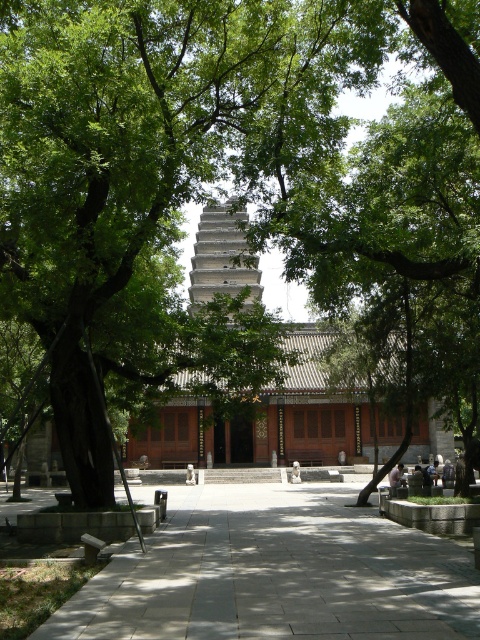
Does gray stone pavement at center have a lesser height compared to gray stone tower at center?

Yes, gray stone pavement at center is shorter than gray stone tower at center.

Which is behind, point (374, 540) or point (226, 209)?

The point (226, 209) is more distant.

Is point (333, 545) positioned before point (202, 300)?

Yes, point (333, 545) is closer to viewer.

Where is `gray stone pavement at center`? Image resolution: width=480 pixels, height=640 pixels. gray stone pavement at center is located at coordinates (x=276, y=573).

Does gray stone tower at center appear under light brown wooden bench at center?

Actually, gray stone tower at center is above light brown wooden bench at center.

Is gray stone tower at center to the left of light brown wooden bench at center from the viewer's perspective?

Yes, gray stone tower at center is to the left of light brown wooden bench at center.

Locate an element on the screen. The width and height of the screenshot is (480, 640). gray stone tower at center is located at coordinates (223, 257).

Where is `gray stone tower at center`? This screenshot has height=640, width=480. gray stone tower at center is located at coordinates (223, 257).

Is gray stone pavement at center below light brown wooden bench at center?

No.

Is gray stone pavement at center further to camera compared to light brown wooden bench at center?

No.

The height and width of the screenshot is (640, 480). What do you see at coordinates (276, 573) in the screenshot?
I see `gray stone pavement at center` at bounding box center [276, 573].

You are a GUI agent. You are given a task and a screenshot of the screen. Output one action in this format:
    pyautogui.click(x=<x>, y=<y>)
    Task: Click on the gray stone pavement at center
    This screenshot has width=480, height=640.
    Given the screenshot: What is the action you would take?
    pyautogui.click(x=276, y=573)